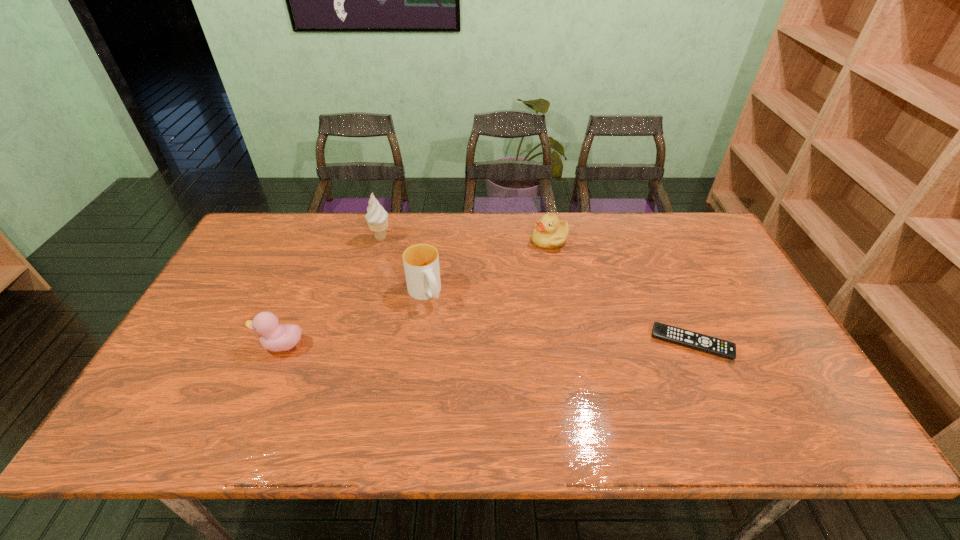
Locate an element on the screen. The height and width of the screenshot is (540, 960). vacant space on the desktop that is between the left duckling and the rightmost object and is positioned on the front-facing side of the icecream is located at coordinates (482, 344).

This screenshot has width=960, height=540. In order to click on free space on the desktop that is between the nearer duckling and the shortest object and is positioned with the handle on the side of the third object from right to left in this screenshot , I will do `click(453, 344)`.

Image resolution: width=960 pixels, height=540 pixels. I want to click on vacant space on the desktop that is between the leftmost object and the remote control and is positioned on the front-facing side of the farther duckling, so click(x=448, y=345).